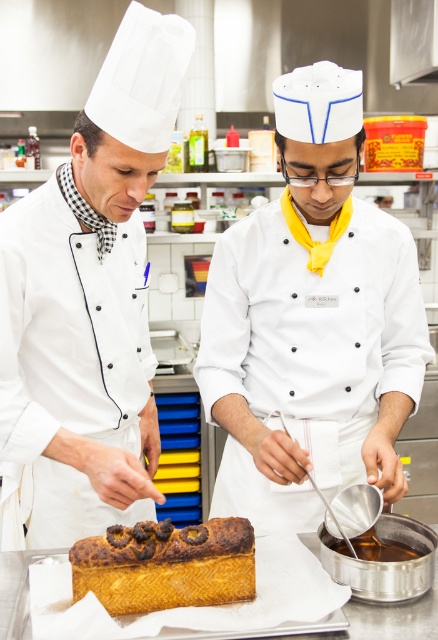
Can you confirm if white matte chef hat at left is smaller than golden brown sponge cake at center?

No.

This screenshot has width=438, height=640. What do you see at coordinates (88, 305) in the screenshot?
I see `white matte chef hat at left` at bounding box center [88, 305].

The height and width of the screenshot is (640, 438). In order to click on white matte chef hat at left in this screenshot , I will do `click(88, 305)`.

Describe the element at coordinates (311, 321) in the screenshot. This screenshot has height=640, width=438. I see `white glossy chef hat at center` at that location.

Between white glossy chef hat at center and golden brown sponge cake at center, which one has more height?

white glossy chef hat at center

Is point (334, 266) behind point (247, 552)?

Yes, point (334, 266) is farther from viewer.

Where is `white glossy chef hat at center`? Image resolution: width=438 pixels, height=640 pixels. white glossy chef hat at center is located at coordinates (x=311, y=321).

Who is lower down, white glossy chef hat at center or white matte chef hat at left?

Positioned lower is white glossy chef hat at center.

Is point (328, 483) behind point (89, 480)?

Yes, it is.

The height and width of the screenshot is (640, 438). What are the coordinates of `white glossy chef hat at center` in the screenshot? It's located at tap(311, 321).